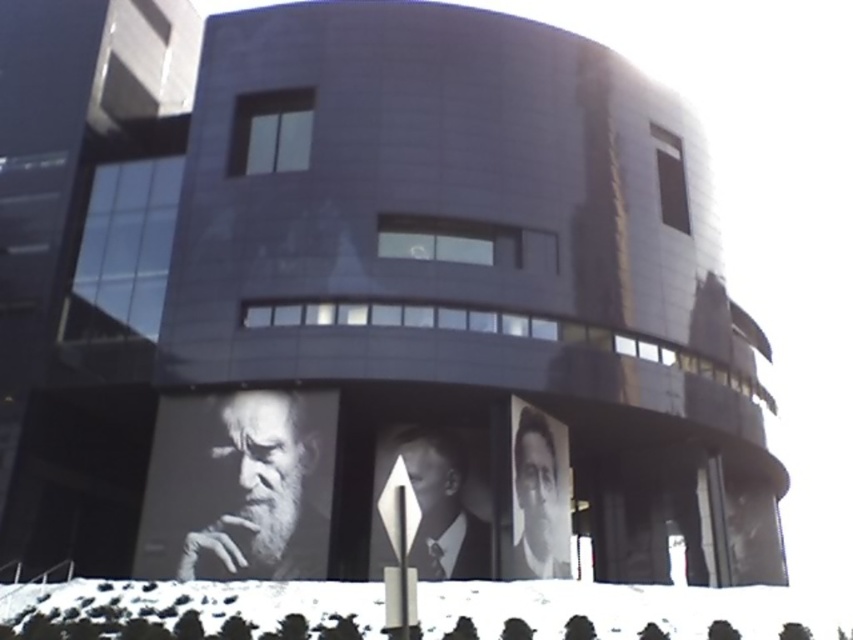
Can you confirm if black and white portrait at center is bigger than black and white portrait at lower right?

No.

Which is behind, point (474, 566) or point (548, 561)?

The point (474, 566) is more distant.

What do you see at coordinates (442, 508) in the screenshot? This screenshot has width=853, height=640. I see `black and white portrait at center` at bounding box center [442, 508].

Image resolution: width=853 pixels, height=640 pixels. What are the coordinates of `black and white portrait at center` in the screenshot? It's located at (442, 508).

Is black and white portrait at lower left bigger than black and white portrait at lower right?

No.

Between black and white portrait at lower left and black and white portrait at lower right, which one has more height?

black and white portrait at lower right

You are a GUI agent. You are given a task and a screenshot of the screen. Output one action in this format:
    pyautogui.click(x=<x>, y=<y>)
    Task: Click on the black and white portrait at lower left
    The image size is (853, 640).
    Given the screenshot: What is the action you would take?
    pyautogui.click(x=263, y=484)

Is black and white portrait at lower left taller than black and white portrait at center?

No.

Between point (283, 525) and point (457, 563), which one is positioned behind?

The point (457, 563) is more distant.

This screenshot has width=853, height=640. I want to click on black and white portrait at lower left, so click(x=263, y=484).